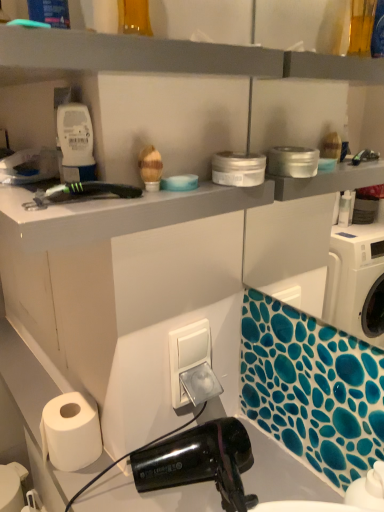
Find the location of a particular element. white matte paper towel at lower left is located at coordinates click(70, 432).

The image size is (384, 512). What are the coordinates of `gray matte shelf at upper center` in the screenshot? It's located at click(123, 56).

Image resolution: width=384 pixels, height=512 pixels. I want to click on white plastic switch at center, so click(192, 365).

In the scene shown: Considering the sizes of white matte paper towel at lower left and gray matte shelf at upper center in the image, is white matte paper towel at lower left wider or thinner than gray matte shelf at upper center?

Considering their sizes, white matte paper towel at lower left looks slimmer than gray matte shelf at upper center.

Considering the relative sizes of white matte paper towel at lower left and gray matte shelf at upper center in the image provided, is white matte paper towel at lower left shorter than gray matte shelf at upper center?

In fact, white matte paper towel at lower left may be taller than gray matte shelf at upper center.

Which is in front, point (58, 454) or point (80, 54)?

Point (80, 54)

From a real-world perspective, is white matte paper towel at lower left positioned above or below white plastic switch at center?

From a real-world perspective, white matte paper towel at lower left is physically below white plastic switch at center.

This screenshot has height=512, width=384. In the image, there is a white matte paper towel at lower left. Find the location of `electric outlet above it (from the image's perspective)`. electric outlet above it (from the image's perspective) is located at coordinates pyautogui.click(x=192, y=365).

From the image's perspective, is white matte paper towel at lower left above white plastic switch at center?

No, from the image's perspective, white matte paper towel at lower left is not on top of white plastic switch at center.

Considering the relative positions of white matte paper towel at lower left and white plastic switch at center in the image provided, is white matte paper towel at lower left in front of white plastic switch at center?

Yes, it is in front of white plastic switch at center.

Who is smaller, white plastic switch at center or gray matte shelf at upper center?

With smaller size is white plastic switch at center.

Visually, is white plastic switch at center positioned to the left or to the right of gray matte shelf at upper center?

In the image, white plastic switch at center appears on the right side of gray matte shelf at upper center.

Is the position of white plastic switch at center less distant than that of gray matte shelf at upper center?

No.

From the image's perspective, does gray matte shelf at upper center appear lower than white matte paper towel at lower left?

Incorrect, from the image's perspective, gray matte shelf at upper center is higher than white matte paper towel at lower left.

Where is `shelf that is in front of the white matte paper towel at lower left`? shelf that is in front of the white matte paper towel at lower left is located at coordinates (123, 56).

Is gray matte shelf at upper center positioned before white matte paper towel at lower left?

That is True.

Does gray matte shelf at upper center turn towards white matte paper towel at lower left?

No, gray matte shelf at upper center does not turn towards white matte paper towel at lower left.

Does point (247, 59) lie behind point (198, 362)?

That is False.

From the image's perspective, is gray matte shelf at upper center below white plastic switch at center?

Incorrect, from the image's perspective, gray matte shelf at upper center is higher than white plastic switch at center.

From a real-world perspective, between gray matte shelf at upper center and white plastic switch at center, who is vertically lower?

white plastic switch at center is physically lower.

Based on the photo, is gray matte shelf at upper center turned away from white plastic switch at center?

No.

Considering the positions of objects white plastic switch at center and white matte paper towel at lower left in the image provided, who is more to the right, white plastic switch at center or white matte paper towel at lower left?

white plastic switch at center is more to the right.

Is point (209, 376) more distant than point (52, 421)?

Yes, it is.

Does white plastic switch at center have a greater width compared to white matte paper towel at lower left?

No.

Is white plastic switch at center next to white matte paper towel at lower left and touching it?

white plastic switch at center and white matte paper towel at lower left are not in contact.

In the image, there is a gray matte shelf at upper center. Where is `paper towel below it (from a real-world perspective)`? paper towel below it (from a real-world perspective) is located at coordinates (70, 432).

Where is `electric outlet lying behind the white matte paper towel at lower left`? Image resolution: width=384 pixels, height=512 pixels. electric outlet lying behind the white matte paper towel at lower left is located at coordinates (192, 365).

From the image, which object appears to be farther from white matte paper towel at lower left, gray matte shelf at upper center or white plastic switch at center?

Based on the image, gray matte shelf at upper center appears to be further to white matte paper towel at lower left.

Based on their spatial positions, is white matte paper towel at lower left or white plastic switch at center further from gray matte shelf at upper center?

The object further to gray matte shelf at upper center is white matte paper towel at lower left.

Which object lies further to the anchor point gray matte shelf at upper center, white plastic switch at center or white matte paper towel at lower left?

Among the two, white matte paper towel at lower left is located further to gray matte shelf at upper center.

From the image, which object appears to be nearer to white plastic switch at center, white matte paper towel at lower left or gray matte shelf at upper center?

Among the two, white matte paper towel at lower left is located nearer to white plastic switch at center.

When comparing their distances from white matte paper towel at lower left, does white plastic switch at center or gray matte shelf at upper center seem closer?

Based on the image, white plastic switch at center appears to be nearer to white matte paper towel at lower left.

From the image, which object appears to be nearer to white plastic switch at center, gray matte shelf at upper center or white matte paper towel at lower left?

Among the two, white matte paper towel at lower left is located nearer to white plastic switch at center.

I want to click on electric outlet between gray matte shelf at upper center and white matte paper towel at lower left in the up-down direction, so click(x=192, y=365).